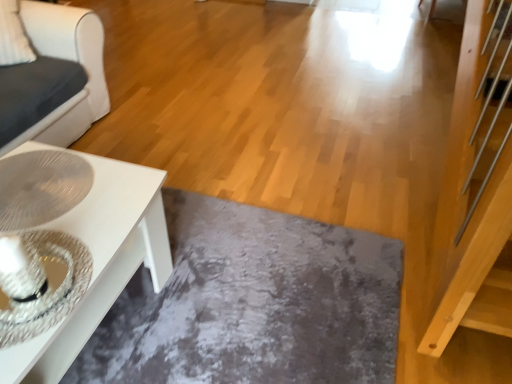
Question: Can you confirm if slate at lower center is smaller than white glossy table at lower left?

Choices:
 (A) yes
 (B) no

Answer: (A)

Question: Could white glossy table at lower left be considered to be inside slate at lower center?

Choices:
 (A) no
 (B) yes

Answer: (A)

Question: Is slate at lower center far from white glossy table at lower left?

Choices:
 (A) no
 (B) yes

Answer: (A)

Question: Considering the relative sizes of slate at lower center and white glossy table at lower left in the image provided, is slate at lower center bigger than white glossy table at lower left?

Choices:
 (A) no
 (B) yes

Answer: (A)

Question: Is slate at lower center positioned with its back to white glossy table at lower left?

Choices:
 (A) yes
 (B) no

Answer: (B)

Question: In terms of height, does slate at lower center look taller or shorter compared to white glossy table at lower left?

Choices:
 (A) tall
 (B) short

Answer: (B)

Question: From the image's perspective, is slate at lower center located above or below white glossy table at lower left?

Choices:
 (A) above
 (B) below

Answer: (B)

Question: In the image, is slate at lower center on the left side or the right side of white glossy table at lower left?

Choices:
 (A) left
 (B) right

Answer: (B)

Question: Which is correct: slate at lower center is inside white glossy table at lower left, or outside of it?

Choices:
 (A) inside
 (B) outside

Answer: (B)

Question: Is white glossy table at lower left in front of or behind slate at lower center in the image?

Choices:
 (A) front
 (B) behind

Answer: (A)

Question: Is white glossy table at lower left inside the boundaries of slate at lower center, or outside?

Choices:
 (A) outside
 (B) inside

Answer: (A)

Question: From a real-world perspective, is white glossy table at lower left positioned above or below slate at lower center?

Choices:
 (A) below
 (B) above

Answer: (B)

Question: Does point (53, 349) appear closer or farther from the camera than point (303, 337)?

Choices:
 (A) closer
 (B) farther

Answer: (A)

Question: Is white glossy table at lower left bigger or smaller than white glossy coffee table at lower left?

Choices:
 (A) small
 (B) big

Answer: (A)

Question: Is point (90, 155) closer or farther from the camera than point (33, 110)?

Choices:
 (A) farther
 (B) closer

Answer: (B)